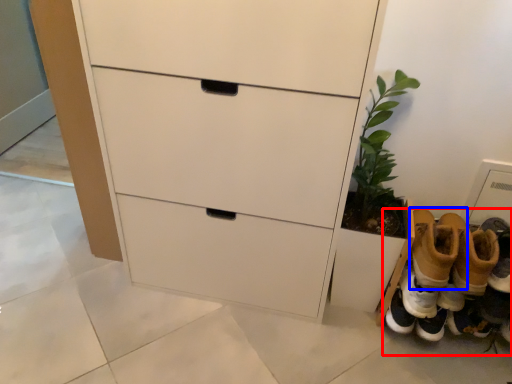
Question: Which point is further to the camera, footwear (highlighted by a red box) or footwear (highlighted by a blue box)?

Choices:
 (A) footwear
 (B) footwear

Answer: (A)